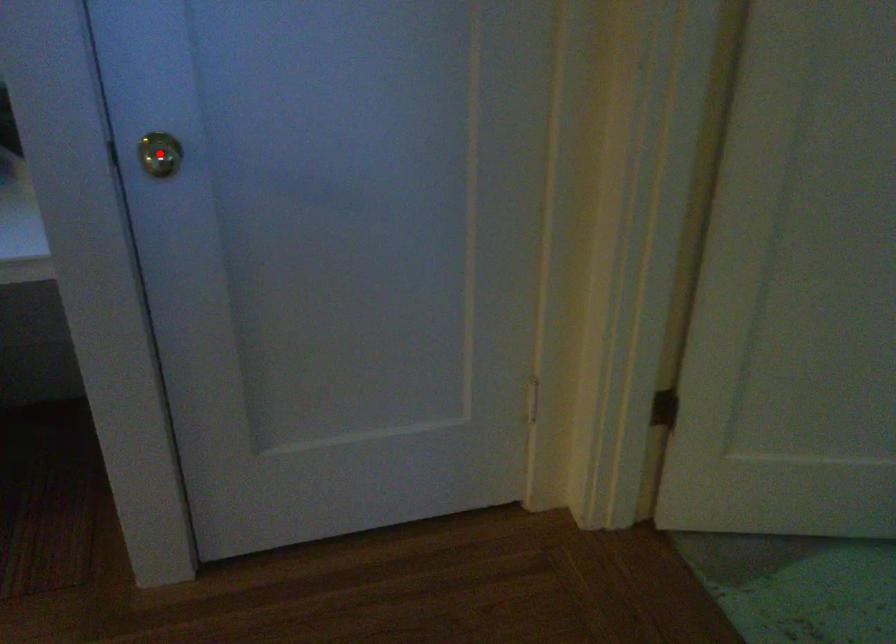
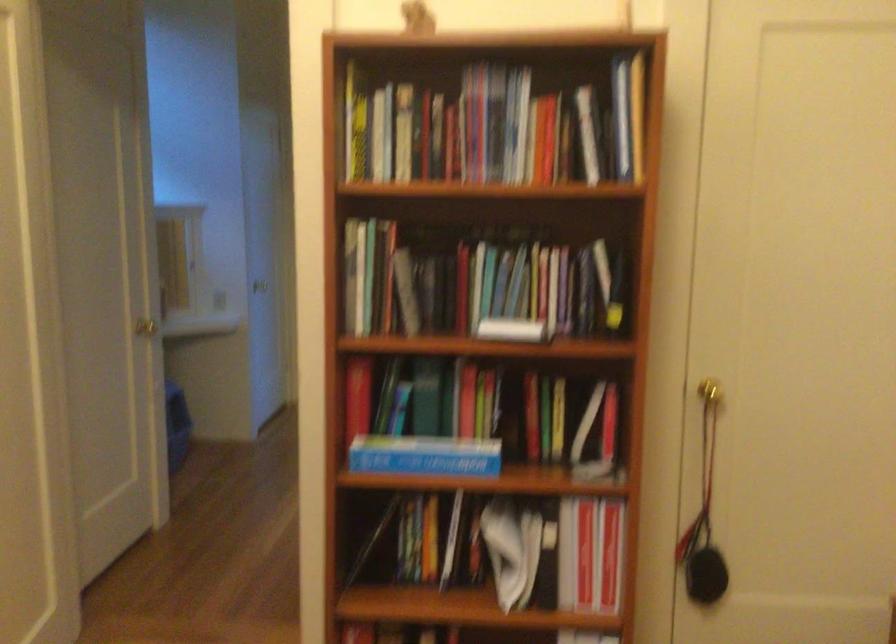
Question: I am providing you with two images of the same scene from different viewpoints. A red point is marked on the first image. Can you still see the location of the red point in image 2?

Choices:
 (A) Yes
 (B) No

Answer: (B)